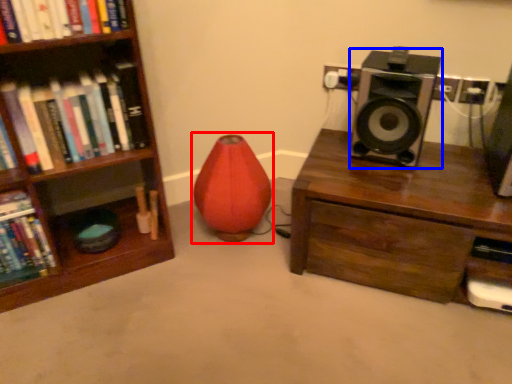
Question: Which of the following is the closest to the observer, bean bag chair (highlighted by a red box) or speaker (highlighted by a blue box)?

Choices:
 (A) bean bag chair
 (B) speaker

Answer: (B)